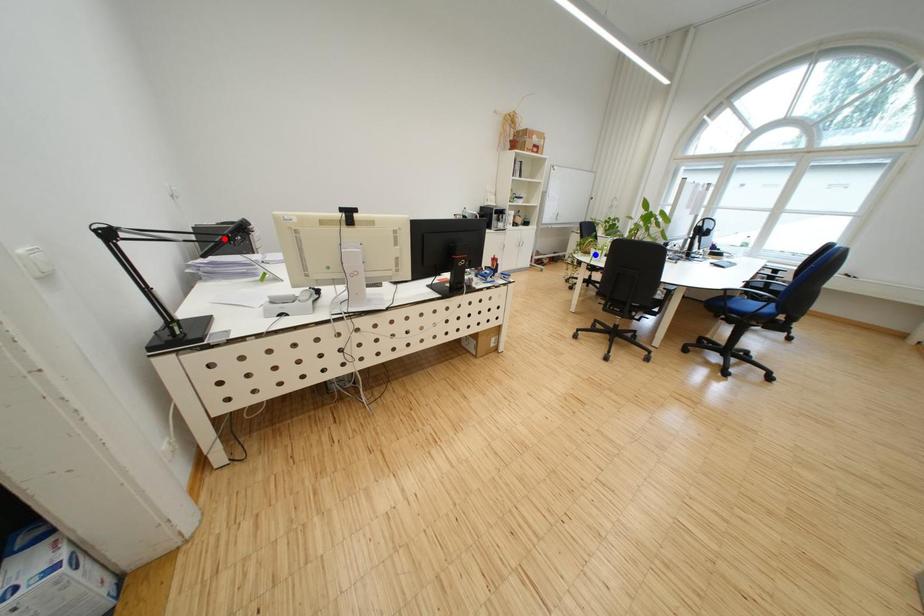
Question: In the image, two points are highlighted. Which point is nearer to the camera? Reply with the corresponding letter.

Choices:
 (A) blue point
 (B) red point

Answer: (B)